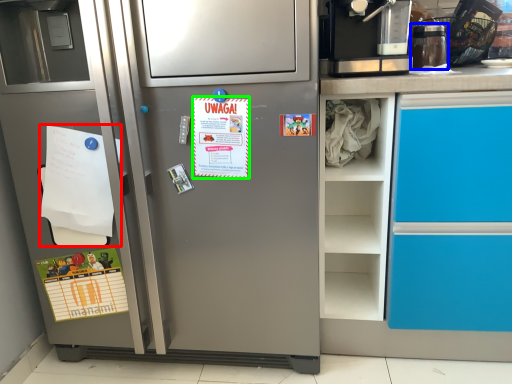
Question: Estimate the real-world distances between objects in this image. Which object is farther from flyer (highlighted by a red box), appliance (highlighted by a blue box) or postcard (highlighted by a green box)?

Choices:
 (A) appliance
 (B) postcard

Answer: (A)